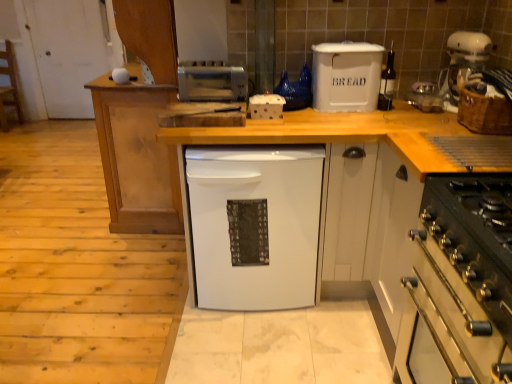
This screenshot has height=384, width=512. I want to click on free area in between matte white wine bottle at center, the second appliance when ordered from right to left, and clear plastic container at upper right, the 4th appliance viewed from the left, so click(x=400, y=111).